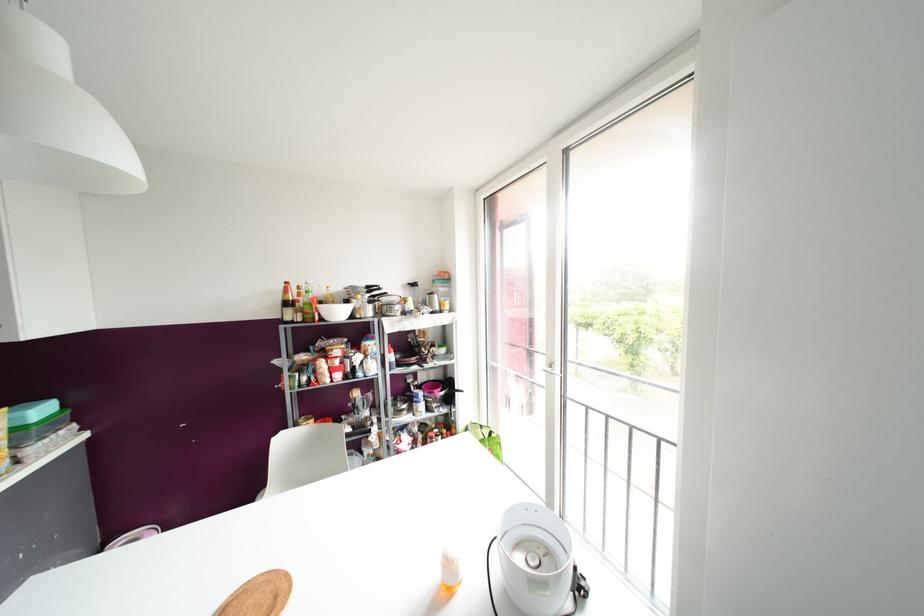
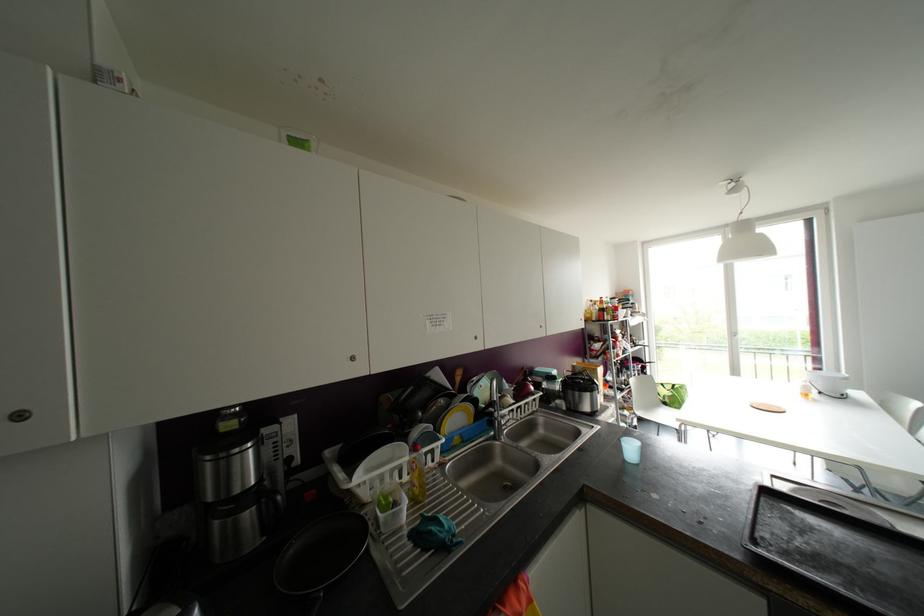
Question: Which direction would the cameraman need to move to produce the second image? Reply with the corresponding letter.

Choices:
 (A) Left
 (B) Right
 (C) Forward
 (D) Backward

Answer: (A)